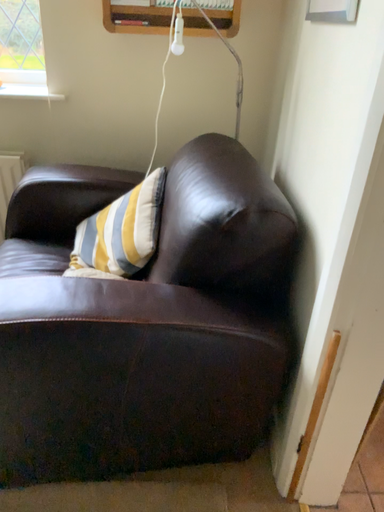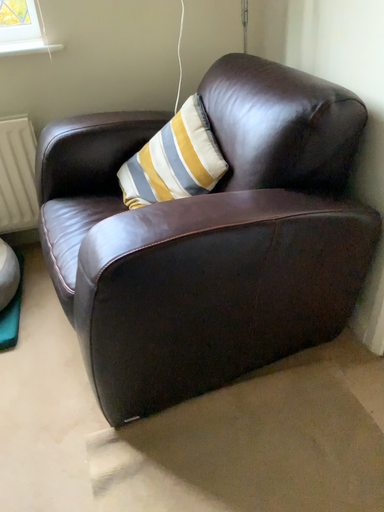
Question: Which way did the camera rotate in the video?

Choices:
 (A) rotated right
 (B) rotated left

Answer: (A)